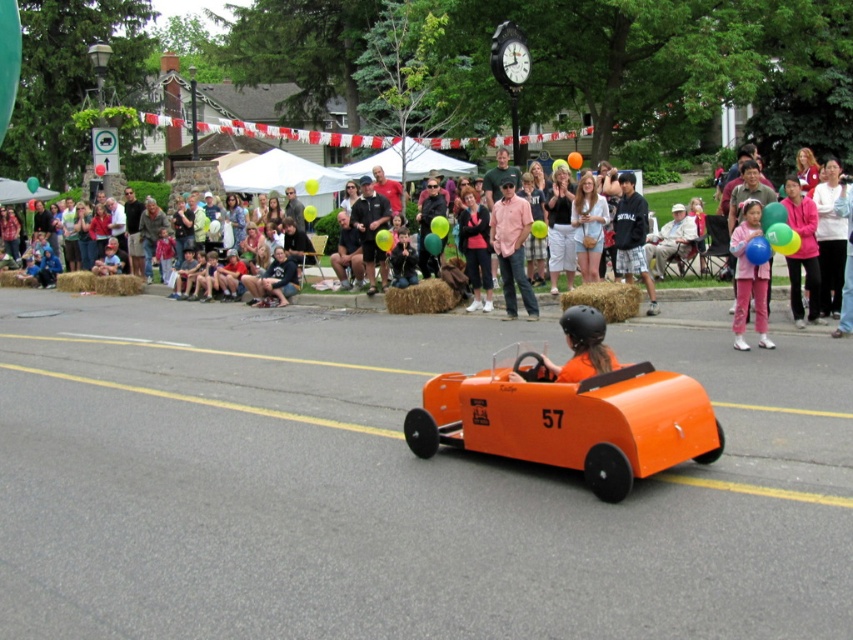
Is matte orange balloons at upper center behind pink cotton shirt at center?

No, matte orange balloons at upper center is in front of pink cotton shirt at center.

Can you confirm if matte orange balloons at upper center is thinner than pink cotton shirt at center?

No, matte orange balloons at upper center is not thinner than pink cotton shirt at center.

What do you see at coordinates (259, 164) in the screenshot? I see `matte orange balloons at upper center` at bounding box center [259, 164].

Where is `matte orange balloons at upper center`? The image size is (853, 640). matte orange balloons at upper center is located at coordinates (259, 164).

Who is more forward, (746, 269) or (653, 294)?

Point (746, 269) is in front.

Does point (759, 342) come behind point (650, 294)?

That is False.

Where is `matte pink pants at right`? The width and height of the screenshot is (853, 640). matte pink pants at right is located at coordinates (749, 278).

Who is positioned more to the left, matte pink pants at right or matte pink shirt at center?

matte pink shirt at center is more to the left.

Who is shorter, matte pink pants at right or matte pink shirt at center?

Standing shorter between the two is matte pink pants at right.

Which is behind, point (730, 244) or point (467, 230)?

Point (467, 230)

At what (x,y) coordinates should I click in order to perform the action: click on matte pink pants at right. Please return your answer as a coordinate pair (x, y). Looking at the image, I should click on coord(749,278).